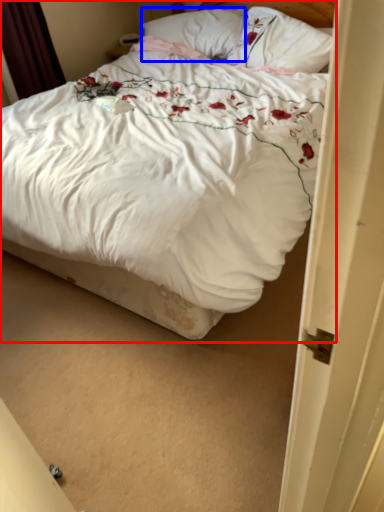
Question: Which of the following is the farthest to the observer, bed (highlighted by a red box) or pillow (highlighted by a blue box)?

Choices:
 (A) bed
 (B) pillow

Answer: (B)